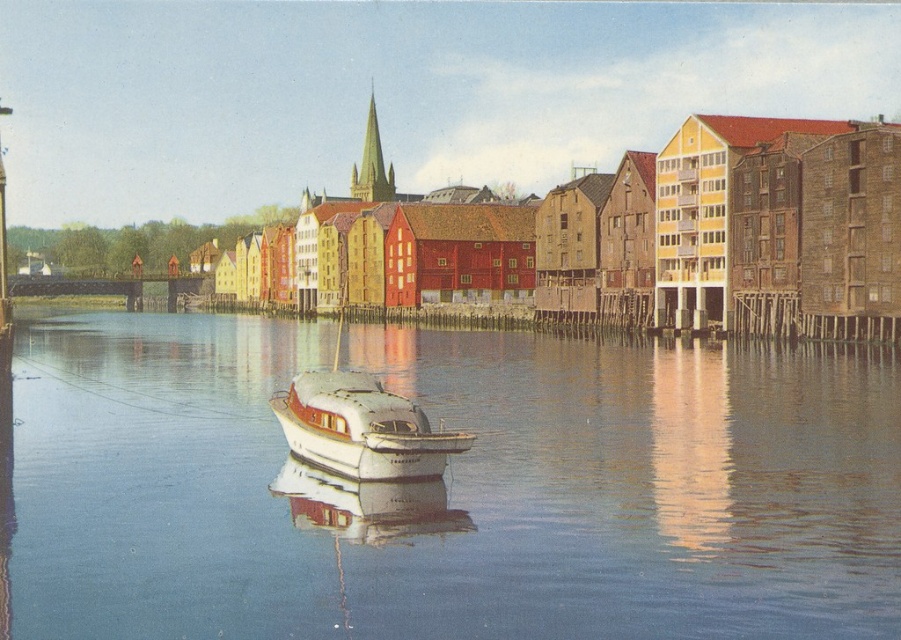
You are a tour guide leading a group along the riverside. You want to inform your visitors about the distance between the blue smooth water at center and the white glossy boat at center. What would you tell them?

The distance between the blue smooth water at center and the white glossy boat at center is approximately 10 meters.

You are standing on the riverside and want to take a photo of the white glossy boat at center and the blue smooth water at center. Which object should you focus on first if you want to capture both in a single shot without moving the camera?

You should focus on the white glossy boat at center first because the blue smooth water at center is in front of it, so adjusting focus to the boat will ensure both are in the frame.

You are standing on the riverside path and see the blue smooth water at center and the green stone spire at upper center. Which object is positioned to the right of the other?

The blue smooth water at center is to the right of the green stone spire at upper center.